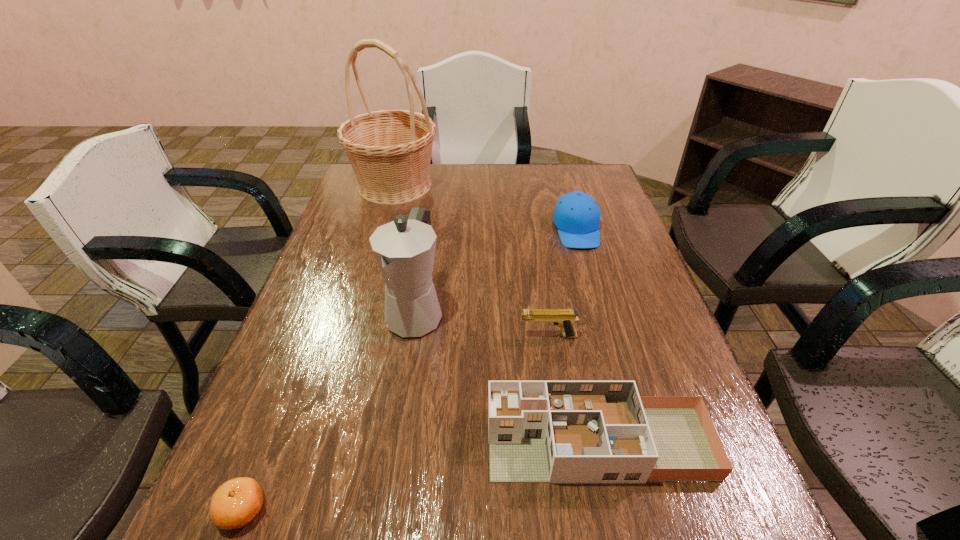
Find the location of `basket that is at the left edge`. basket that is at the left edge is located at coordinates (390, 151).

Locate an element on the screen. Image resolution: width=960 pixels, height=540 pixels. clementine that is at the left edge is located at coordinates (235, 503).

Find the location of `cap situated at the right edge`. cap situated at the right edge is located at coordinates (576, 215).

Find the location of a particular element. The width and height of the screenshot is (960, 540). dollhouse at the right edge is located at coordinates (538, 431).

This screenshot has height=540, width=960. Find the location of `object located at the far left corner`. object located at the far left corner is located at coordinates (390, 151).

You are a GUI agent. You are given a task and a screenshot of the screen. Output one action in this format:
    pyautogui.click(x=<x>, y=<y>)
    Task: Click on the object present at the near left corner
    
    Given the screenshot: What is the action you would take?
    pyautogui.click(x=235, y=503)

You are a GUI agent. You are given a task and a screenshot of the screen. Output one action in this format:
    pyautogui.click(x=<x>, y=<y>)
    Task: Click on the vacant area at the far edge
    
    Given the screenshot: What is the action you would take?
    pyautogui.click(x=521, y=165)

In the image, there is a desktop. What are the coordinates of `free region at the near edge` in the screenshot? It's located at (518, 527).

The height and width of the screenshot is (540, 960). I want to click on vacant space at the left edge of the desktop, so click(x=304, y=364).

The height and width of the screenshot is (540, 960). In the image, there is a desktop. Identify the location of blank space at the right edge. (686, 367).